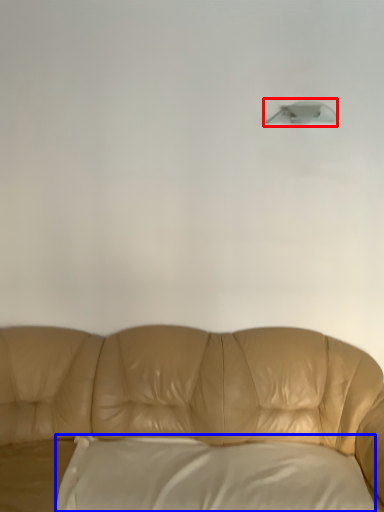
Question: Which of the following is the farthest to the observer, lamp (highlighted by a red box) or pillow (highlighted by a blue box)?

Choices:
 (A) lamp
 (B) pillow

Answer: (A)